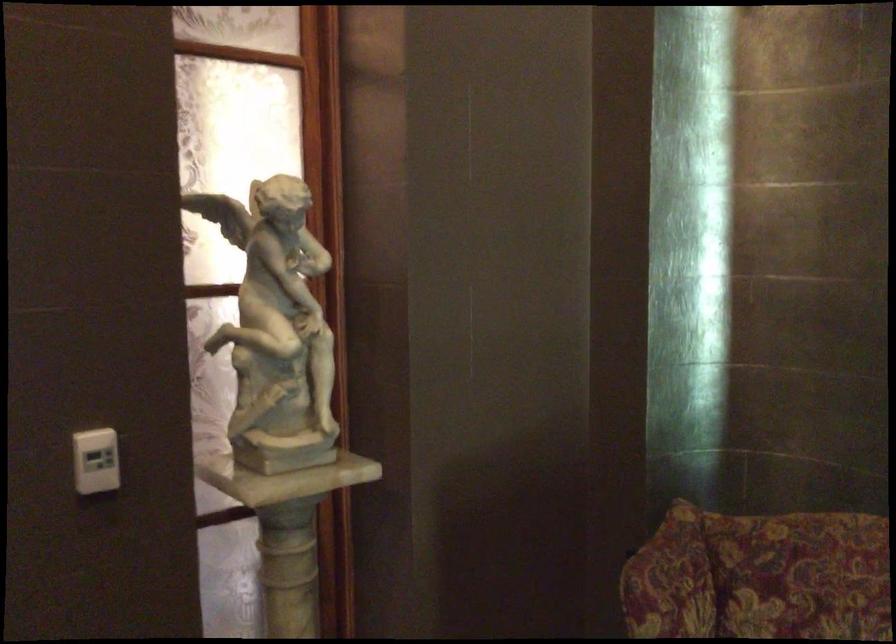
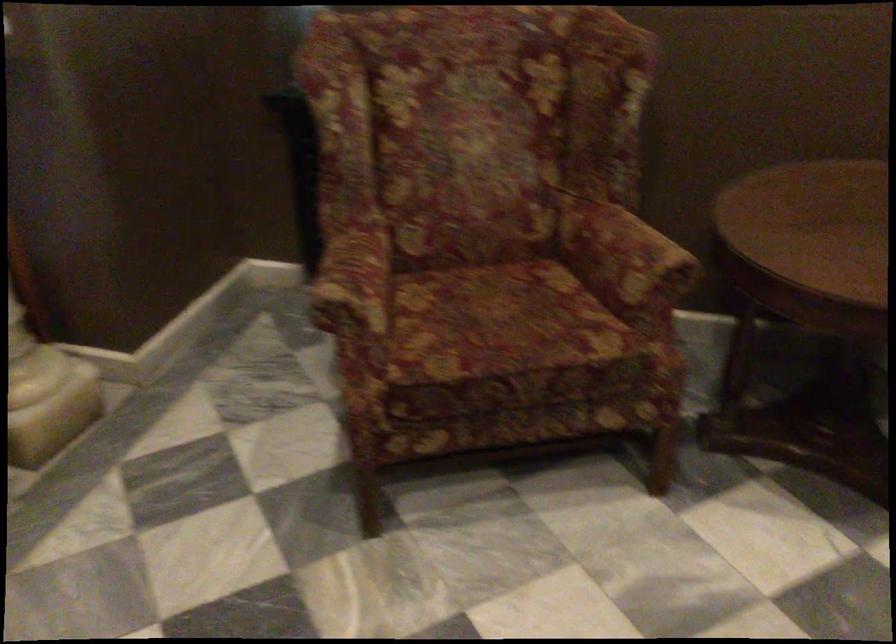
The images are taken continuously from a first-person perspective. In which direction is your viewpoint rotating?

The camera's rotation is toward right-down.